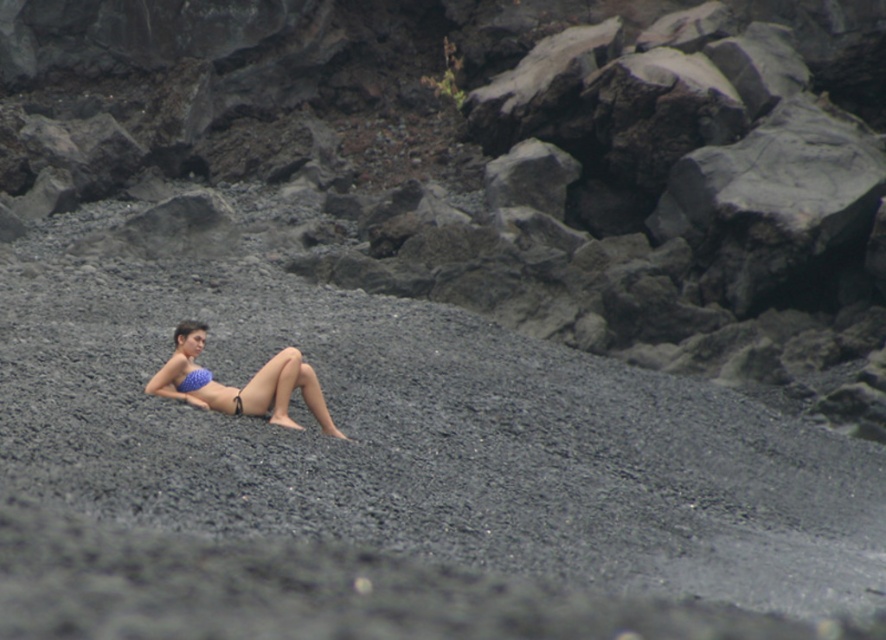
Can you confirm if gray gravel at center is taller than blue bikini top at center?

Indeed, gray gravel at center has a greater height compared to blue bikini top at center.

Who is taller, gray gravel at center or blue bikini top at center?

With more height is gray gravel at center.

This screenshot has height=640, width=886. Describe the element at coordinates (394, 474) in the screenshot. I see `gray gravel at center` at that location.

At what (x,y) coordinates should I click in order to perform the action: click on gray gravel at center. Please return your answer as a coordinate pair (x, y). The image size is (886, 640). Looking at the image, I should click on (394, 474).

Who is more forward, (465,260) or (187,381)?

Point (187,381)

Image resolution: width=886 pixels, height=640 pixels. In order to click on smooth gray rock at center in this screenshot , I will do pyautogui.click(x=517, y=160).

Which of these two, gray gravel at center or smooth gray rock at center, stands shorter?

Standing shorter between the two is gray gravel at center.

Between gray gravel at center and smooth gray rock at center, which one is positioned lower?

Positioned lower is gray gravel at center.

Between point (58, 291) and point (843, 97), which one is positioned in front?

Positioned in front is point (58, 291).

Identify the location of gray gravel at center. The height and width of the screenshot is (640, 886). (394, 474).